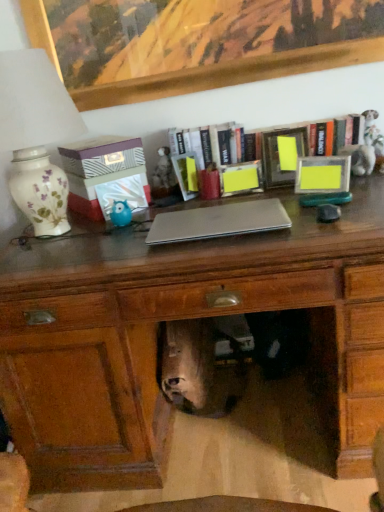
Locate an element on the screen. This screenshot has height=512, width=384. vacant region to the left of matte yellow picture frame at right, the 2th picture frame viewed from the top is located at coordinates (279, 198).